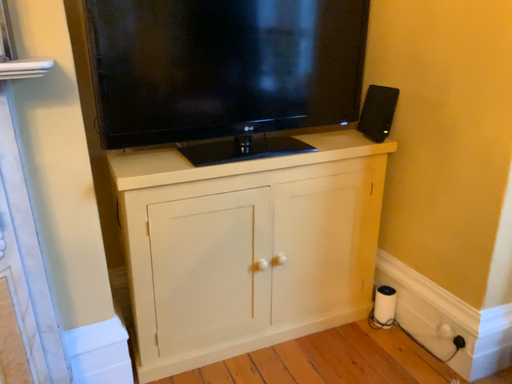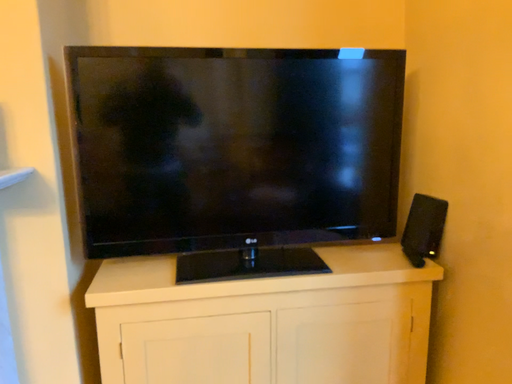
Question: Which way did the camera rotate in the video?

Choices:
 (A) rotated right
 (B) rotated left

Answer: (B)